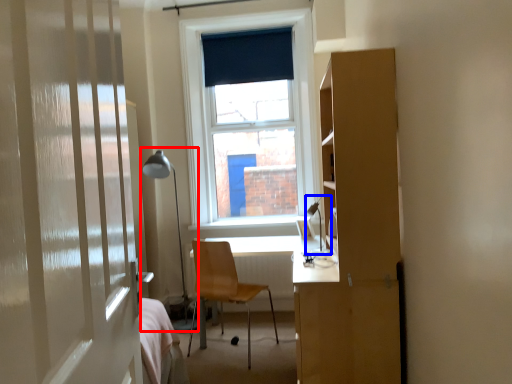
Question: Which object is closer to the camera taking this photo, table lamp (highlighted by a red box) or table lamp (highlighted by a blue box)?

Choices:
 (A) table lamp
 (B) table lamp

Answer: (B)